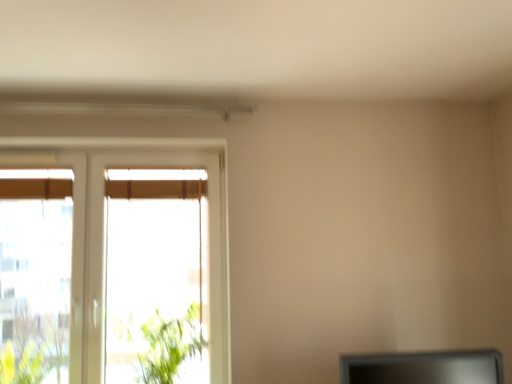
Question: Which is correct: green leafy plant at left is inside white plastic window at left, or outside of it?

Choices:
 (A) outside
 (B) inside

Answer: (A)

Question: From their relative heights in the image, would you say green leafy plant at left is taller or shorter than white plastic window at left?

Choices:
 (A) tall
 (B) short

Answer: (B)

Question: Considering the real-world distances, which object is closest to the green leafy plant at left?

Choices:
 (A) white plastic window at left
 (B) matte black monitor at lower right

Answer: (A)

Question: Which is farther from the white plastic window at left?

Choices:
 (A) matte black monitor at lower right
 (B) green leafy plant at left

Answer: (A)